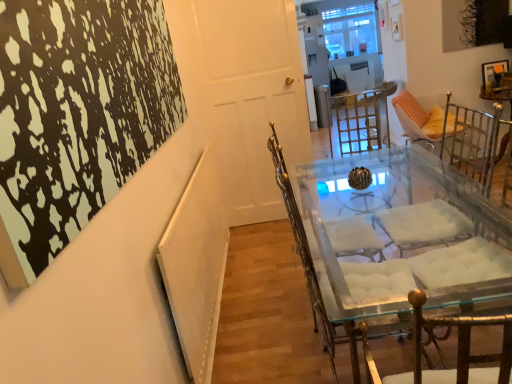
Question: Is clear glass table at center aimed at white glossy door at center?

Choices:
 (A) yes
 (B) no

Answer: (B)

Question: From a real-world perspective, is clear glass table at center located beneath white glossy door at center?

Choices:
 (A) no
 (B) yes

Answer: (B)

Question: Can you confirm if clear glass table at center is wider than white glossy door at center?

Choices:
 (A) no
 (B) yes

Answer: (B)

Question: Considering the relative sizes of clear glass table at center and white glossy door at center in the image provided, is clear glass table at center thinner than white glossy door at center?

Choices:
 (A) no
 (B) yes

Answer: (A)

Question: Is white glossy door at center a part of clear glass table at center?

Choices:
 (A) yes
 (B) no

Answer: (B)

Question: Can you confirm if clear glass table at center is positioned to the right of white glossy door at center?

Choices:
 (A) no
 (B) yes

Answer: (B)

Question: From the image's perspective, is clear glass table at center beneath clear glass chair at center?

Choices:
 (A) no
 (B) yes

Answer: (B)

Question: Does clear glass table at center appear on the left side of clear glass chair at center?

Choices:
 (A) yes
 (B) no

Answer: (B)

Question: From the image's perspective, is clear glass table at center located above clear glass chair at center?

Choices:
 (A) yes
 (B) no

Answer: (B)

Question: Considering the relative sizes of clear glass table at center and clear glass chair at center in the image provided, is clear glass table at center shorter than clear glass chair at center?

Choices:
 (A) yes
 (B) no

Answer: (A)

Question: Is clear glass table at center positioned far away from clear glass chair at center?

Choices:
 (A) no
 (B) yes

Answer: (A)

Question: Does clear glass table at center have a lesser width compared to clear glass chair at center?

Choices:
 (A) no
 (B) yes

Answer: (B)

Question: Could you tell me if clear glass chair at center is turned towards clear glass table at center?

Choices:
 (A) no
 (B) yes

Answer: (A)